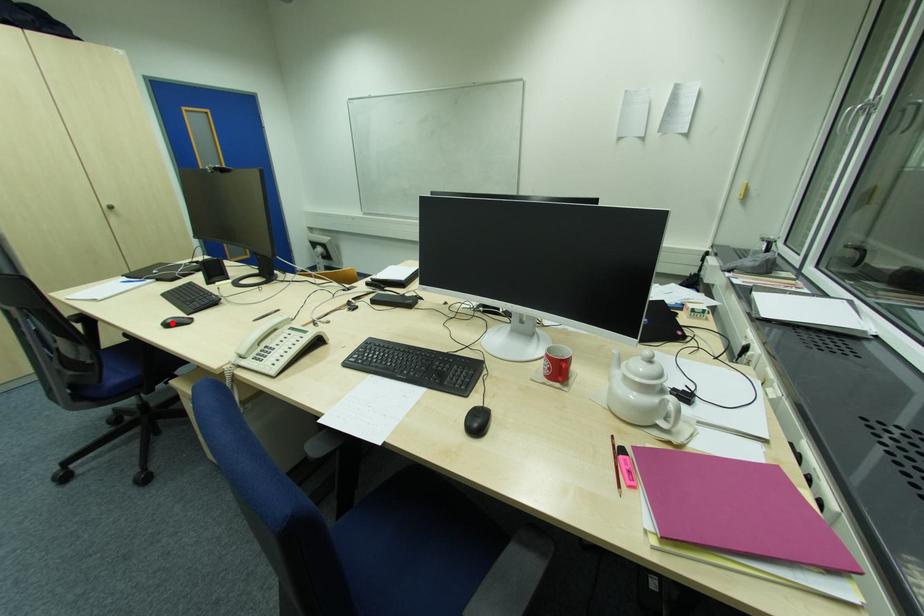
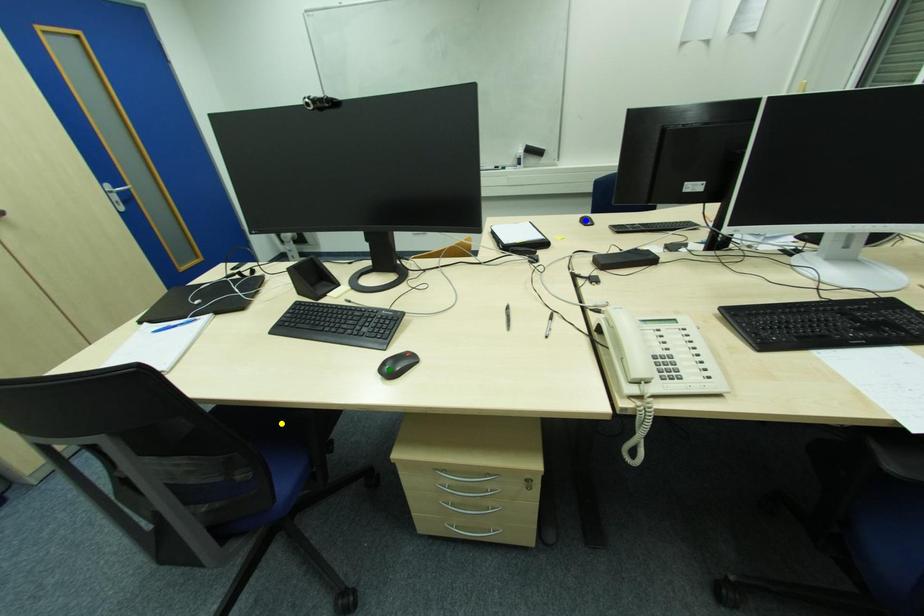
Question: I am providing you with two images of the same scene from different viewpoints. A red point is marked on the first image. You are given multiple points on the second image. Which point in image 2 represents the same 3d spot as the red point in image 1?

Choices:
 (A) blue point
 (B) green point
 (C) yellow point

Answer: (B)